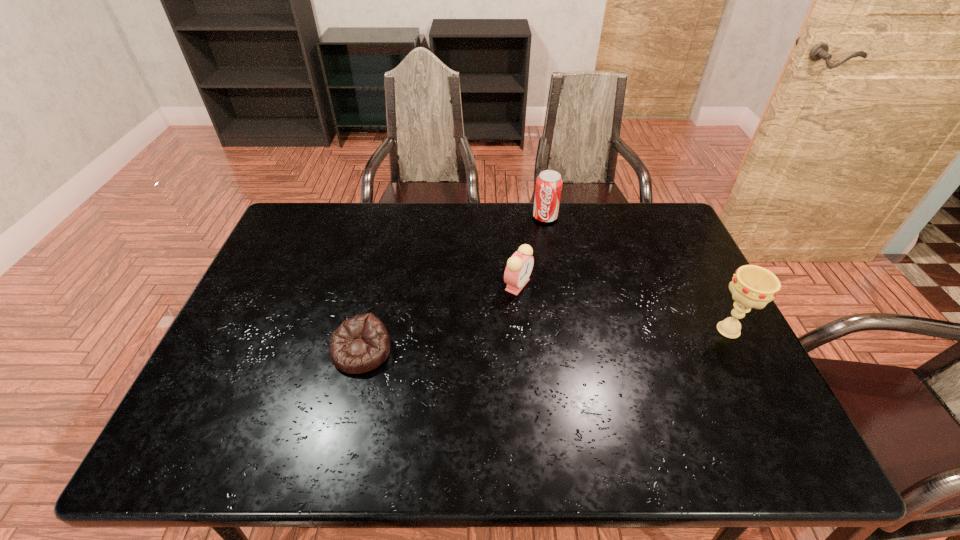
Where is `vacant spot on the desktop that is between the leftmost object and the chalice and is positioned on the face of the second farthest object`? vacant spot on the desktop that is between the leftmost object and the chalice and is positioned on the face of the second farthest object is located at coordinates (547, 340).

At what (x,y) coordinates should I click in order to perform the action: click on vacant space on the desktop that is between the beanbag and the chalice and is positioned on the logo side of the farthest object. Please return your answer as a coordinate pair (x, y). Looking at the image, I should click on (498, 343).